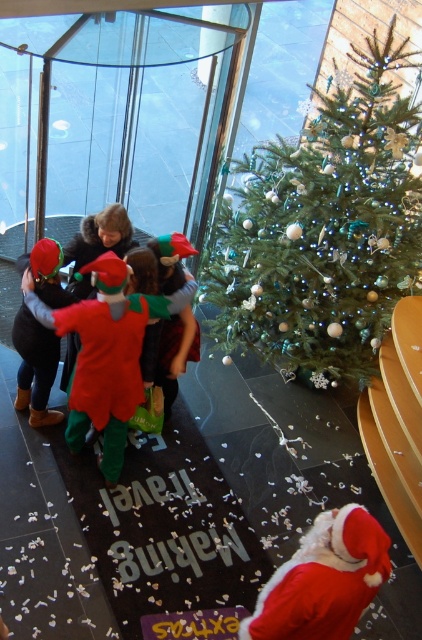
Question: Which point is farther to the camera?

Choices:
 (A) shiny red hat at center
 (B) shiny red fabric elf at center
 (C) red velvet santa at lower right
 (D) green matte christmas tree at upper right

Answer: (D)

Question: Which point appears farthest from the camera in this image?

Choices:
 (A) (65, 436)
 (B) (291, 264)

Answer: (A)

Question: Based on their relative distances, which object is nearer to the shiny red hat at center?

Choices:
 (A) shiny red fabric elf at center
 (B) red velvet santa at lower right

Answer: (A)

Question: Is shiny red fabric elf at center positioned at the back of red velvet santa at lower right?

Choices:
 (A) no
 (B) yes

Answer: (B)

Question: Does shiny red fabric elf at center lie behind red velvet santa at lower right?

Choices:
 (A) yes
 (B) no

Answer: (A)

Question: Does green matte christmas tree at upper right appear on the right side of red velvet santa at lower right?

Choices:
 (A) yes
 (B) no

Answer: (A)